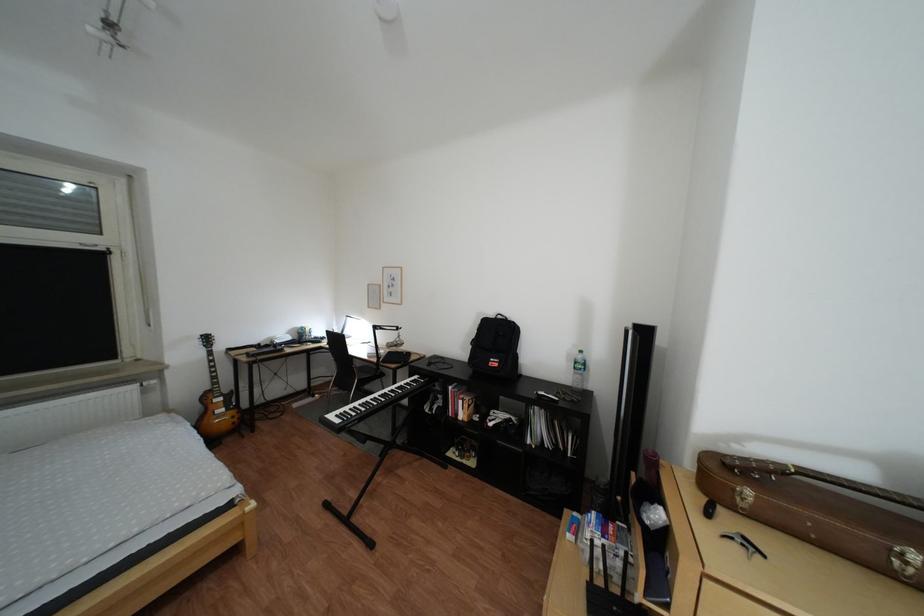
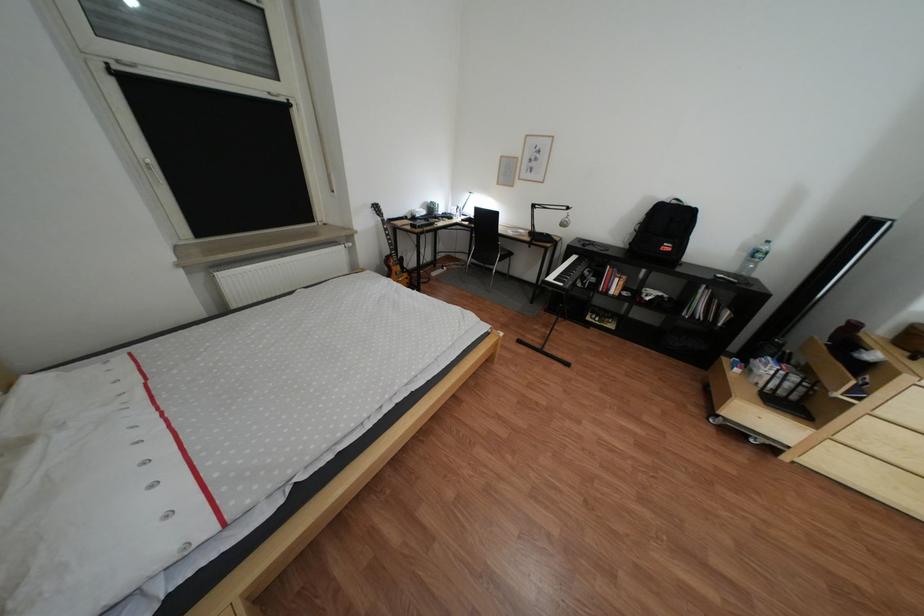
The point at (543, 444) is marked in the first image. Where is the corresponding point in the second image?

(699, 315)